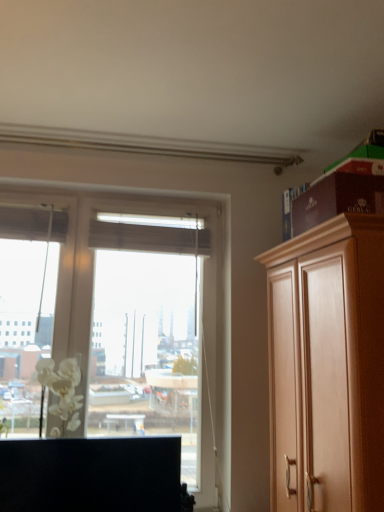
Question: Is white matte flower at left at the right side of wooden cabinet at right, which is the second cabinetry in left-to-right order?

Choices:
 (A) yes
 (B) no

Answer: (B)

Question: Is white matte flower at left far from wooden cabinet at right, which is the second cabinetry in left-to-right order?

Choices:
 (A) yes
 (B) no

Answer: (A)

Question: Can you confirm if white matte flower at left is bigger than wooden cabinet at right, which is the second cabinetry in left-to-right order?

Choices:
 (A) yes
 (B) no

Answer: (B)

Question: Could you tell me if white matte flower at left is turned towards wooden cabinet at right, which is the second cabinetry in left-to-right order?

Choices:
 (A) no
 (B) yes

Answer: (A)

Question: Would you say wooden cabinet at right, which is the second cabinetry in left-to-right order, is part of white matte flower at left's contents?

Choices:
 (A) yes
 (B) no

Answer: (B)

Question: Based on their positions, is black matte cabinet at lower left, marked as the first cabinetry in a left-to-right arrangement, located to the left or right of white matte flower at left?

Choices:
 (A) right
 (B) left

Answer: (A)

Question: Considering the positions of black matte cabinet at lower left, marked as the first cabinetry in a left-to-right arrangement, and white matte flower at left in the image, is black matte cabinet at lower left, marked as the first cabinetry in a left-to-right arrangement, wider or thinner than white matte flower at left?

Choices:
 (A) thin
 (B) wide

Answer: (A)

Question: From a real-world perspective, relative to white matte flower at left, is black matte cabinet at lower left, marked as the first cabinetry in a left-to-right arrangement, vertically above or below?

Choices:
 (A) above
 (B) below

Answer: (B)

Question: Considering the positions of black matte cabinet at lower left, which is counted as the second cabinetry, starting from the right, and white matte flower at left in the image, is black matte cabinet at lower left, which is counted as the second cabinetry, starting from the right, taller or shorter than white matte flower at left?

Choices:
 (A) tall
 (B) short

Answer: (A)

Question: In terms of height, does white matte flower at left look taller or shorter compared to black matte cabinet at lower left, marked as the first cabinetry in a left-to-right arrangement?

Choices:
 (A) tall
 (B) short

Answer: (B)

Question: From a real-world perspective, is white matte flower at left positioned above or below black matte cabinet at lower left, marked as the first cabinetry in a left-to-right arrangement?

Choices:
 (A) below
 (B) above

Answer: (B)

Question: From the image's perspective, relative to black matte cabinet at lower left, marked as the first cabinetry in a left-to-right arrangement, is white matte flower at left above or below?

Choices:
 (A) above
 (B) below

Answer: (A)

Question: Does point (62, 431) appear closer or farther from the camera than point (125, 474)?

Choices:
 (A) farther
 (B) closer

Answer: (A)

Question: From the image's perspective, is wooden cabinet at right, which is the second cabinetry in left-to-right order, above or below black matte cabinet at lower left, which is counted as the second cabinetry, starting from the right?

Choices:
 (A) above
 (B) below

Answer: (A)

Question: In the image, is wooden cabinet at right, which is the second cabinetry in left-to-right order, on the left side or the right side of black matte cabinet at lower left, which is counted as the second cabinetry, starting from the right?

Choices:
 (A) right
 (B) left

Answer: (A)